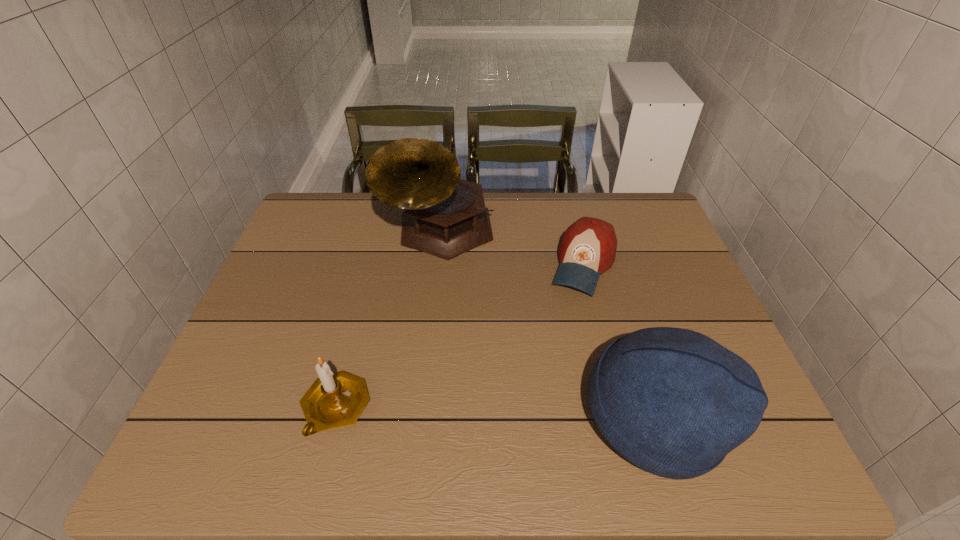
The height and width of the screenshot is (540, 960). What are the coordinates of `free space between the shortest object and the second shortest object` in the screenshot? It's located at (460, 336).

Select which object appears as the closest to the second shortest object. Please provide its 2D coordinates. Your answer should be formatted as a tuple, i.e. [(x, y)], where the tuple contains the x and y coordinates of a point satisfying the conditions above.

[(445, 216)]

Select which object is the closest to the baseball cap. Please provide its 2D coordinates. Your answer should be formatted as a tuple, i.e. [(x, y)], where the tuple contains the x and y coordinates of a point satisfying the conditions above.

[(445, 216)]

Identify the location of vacant area that satisfies the following two spatial constraints: 1. with a handle on the second shortest object; 2. on the right side of the third shortest object. Image resolution: width=960 pixels, height=540 pixels. (334, 416).

Where is `vacant area that satisfies the following two spatial constraints: 1. on the front side of the third shortest object; 2. on the left side of the shortest object`? The height and width of the screenshot is (540, 960). vacant area that satisfies the following two spatial constraints: 1. on the front side of the third shortest object; 2. on the left side of the shortest object is located at coordinates (621, 416).